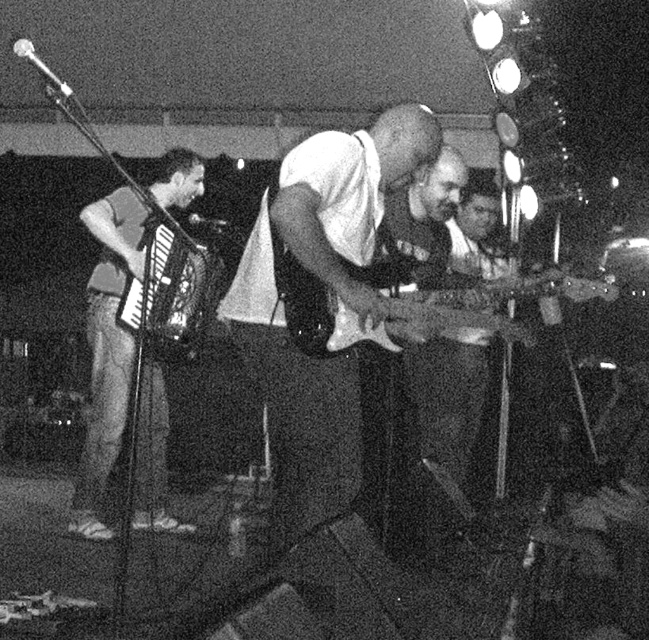
Question: Is white matte guitar at center below matte gray accordion at left?

Choices:
 (A) no
 (B) yes

Answer: (A)

Question: Can you confirm if matte gray accordion at left is smaller than metallic accordion at left?

Choices:
 (A) no
 (B) yes

Answer: (A)

Question: Which of these objects is positioned closest to the metallic silver guitar at center?

Choices:
 (A) matte gray accordion at left
 (B) metallic accordion at left
 (C) white matte guitar at center

Answer: (C)

Question: Which object is closer to the camera taking this photo?

Choices:
 (A) white matte guitar at center
 (B) metallic silver guitar at center

Answer: (A)

Question: Does metallic silver guitar at center come behind metallic accordion at left?

Choices:
 (A) no
 (B) yes

Answer: (A)

Question: Which object is the closest to the matte gray accordion at left?

Choices:
 (A) metallic accordion at left
 (B) metallic silver guitar at center
 (C) white matte guitar at center

Answer: (A)